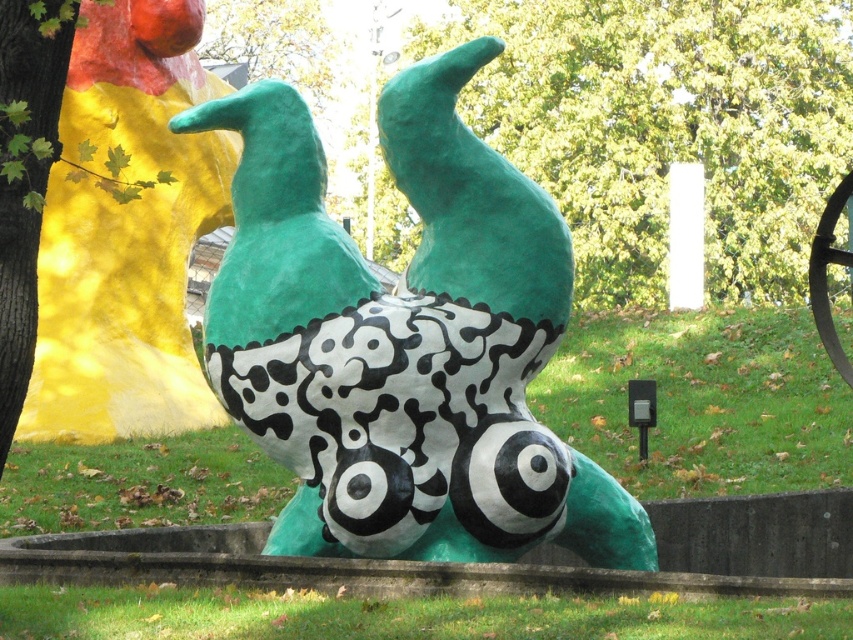
Between point (456, 417) and point (805, 189), which one is positioned behind?

The point (805, 189) is more distant.

Between matte green sculpture at center and green matte tree at upper center, which one appears on the left side from the viewer's perspective?

Positioned to the left is matte green sculpture at center.

Looking at this image, who is more forward, (552,520) or (838,22)?

Positioned in front is point (552,520).

Locate an element on the screen. The width and height of the screenshot is (853, 640). matte green sculpture at center is located at coordinates (403, 340).